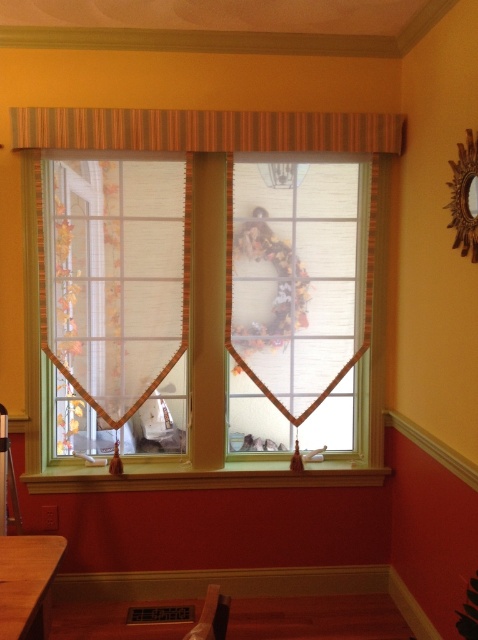
Is the position of matte fabric wreath at center less distant than that of striped fabric valance at upper center?

That is False.

In order to click on matte fabric wreath at center in this screenshot , I will do `click(297, 291)`.

Consider the image. Does matte fabric wreath at center lie behind wooden at lower center?

No.

The height and width of the screenshot is (640, 478). What do you see at coordinates (297, 291) in the screenshot?
I see `matte fabric wreath at center` at bounding box center [297, 291].

The height and width of the screenshot is (640, 478). I want to click on matte fabric wreath at center, so click(297, 291).

Between translucent beige blind at center and brown wooden table at lower left, which one appears on the left side from the viewer's perspective?

From the viewer's perspective, translucent beige blind at center appears more on the left side.

Which of these two, translucent beige blind at center or brown wooden table at lower left, stands taller?

Standing taller between the two is translucent beige blind at center.

You are a GUI agent. You are given a task and a screenshot of the screen. Output one action in this format:
    pyautogui.click(x=<x>, y=<y>)
    Task: Click on the translucent beige blind at center
    Image resolution: width=478 pixels, height=640 pixels.
    Given the screenshot: What is the action you would take?
    pyautogui.click(x=119, y=276)